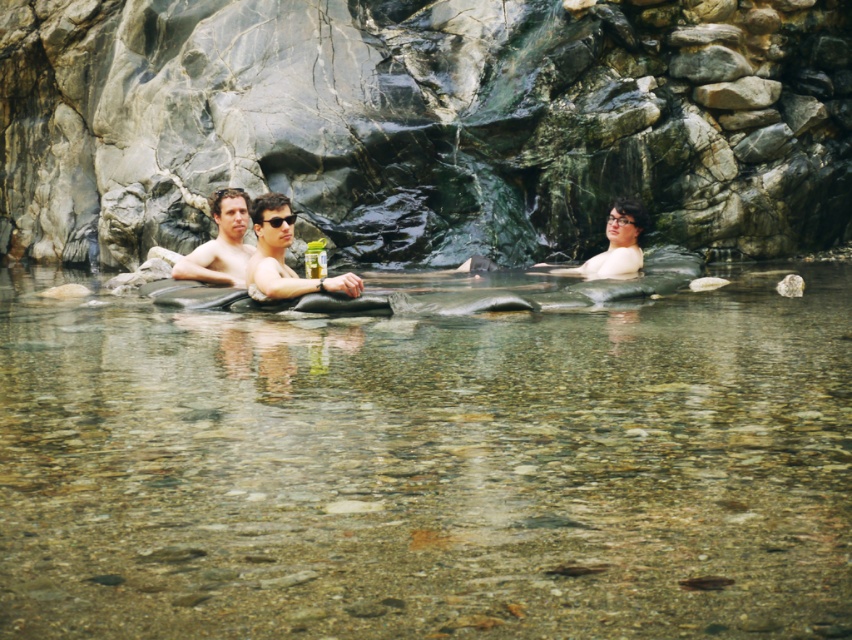
Between point (150, 422) and point (213, 216), which one is positioned in front?

Point (150, 422) is more forward.

Based on the photo, can you confirm if clear stone river at center is positioned to the right of smooth skin man at center?

Indeed, clear stone river at center is positioned on the right side of smooth skin man at center.

Find the location of a particular element. clear stone river at center is located at coordinates (429, 468).

Does clear stone river at center lie behind smooth skin couple at center?

No, clear stone river at center is in front of smooth skin couple at center.

Who is positioned more to the left, clear stone river at center or smooth skin couple at center?

Positioned to the left is smooth skin couple at center.

Describe the element at coordinates (429, 468) in the screenshot. I see `clear stone river at center` at that location.

Where is `clear stone river at center`? This screenshot has width=852, height=640. clear stone river at center is located at coordinates 429,468.

Is smooth skin couple at center to the right of smooth skin man at center from the viewer's perspective?

Indeed, smooth skin couple at center is positioned on the right side of smooth skin man at center.

Locate an element on the screen. The width and height of the screenshot is (852, 640). smooth skin couple at center is located at coordinates (252, 248).